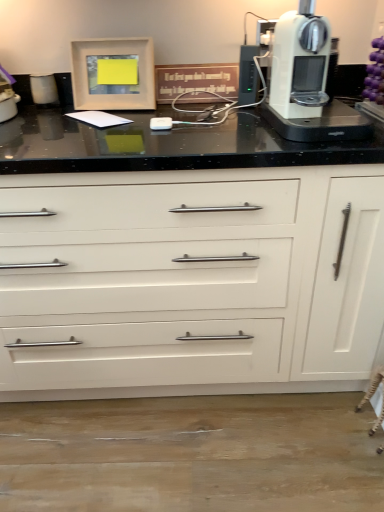
Question: Should I look upward or downward to see matte white trash can at left?

Choices:
 (A) up
 (B) down

Answer: (A)

Question: Can you see white glossy cabinet at center touching white plastic coffee machine at upper right?

Choices:
 (A) yes
 (B) no

Answer: (B)

Question: From the image's perspective, does white glossy cabinet at center appear lower than white plastic coffee machine at upper right?

Choices:
 (A) yes
 (B) no

Answer: (A)

Question: Is white plastic coffee machine at upper right surrounded by white glossy cabinet at center?

Choices:
 (A) no
 (B) yes

Answer: (B)

Question: Is white glossy cabinet at center to the right of white plastic coffee machine at upper right from the viewer's perspective?

Choices:
 (A) no
 (B) yes

Answer: (A)

Question: Considering the relative positions of white glossy cabinet at center and white plastic coffee machine at upper right in the image provided, is white glossy cabinet at center to the left of white plastic coffee machine at upper right from the viewer's perspective?

Choices:
 (A) no
 (B) yes

Answer: (B)

Question: Is white glossy cabinet at center smaller than white plastic coffee machine at upper right?

Choices:
 (A) yes
 (B) no

Answer: (B)

Question: Can you confirm if matte white trash can at left is bigger than matte white picture frame at upper left?

Choices:
 (A) no
 (B) yes

Answer: (A)

Question: Is matte white trash can at left not within matte white picture frame at upper left?

Choices:
 (A) no
 (B) yes

Answer: (B)

Question: From the image's perspective, is matte white trash can at left on matte white picture frame at upper left?

Choices:
 (A) no
 (B) yes

Answer: (A)

Question: Is matte white trash can at left oriented towards matte white picture frame at upper left?

Choices:
 (A) yes
 (B) no

Answer: (B)

Question: Would you say matte white picture frame at upper left is part of matte white trash can at left's contents?

Choices:
 (A) yes
 (B) no

Answer: (B)

Question: Are matte white trash can at left and matte white picture frame at upper left making contact?

Choices:
 (A) yes
 (B) no

Answer: (B)

Question: Is matte white trash can at left far from white plastic coffee machine at upper right?

Choices:
 (A) no
 (B) yes

Answer: (A)